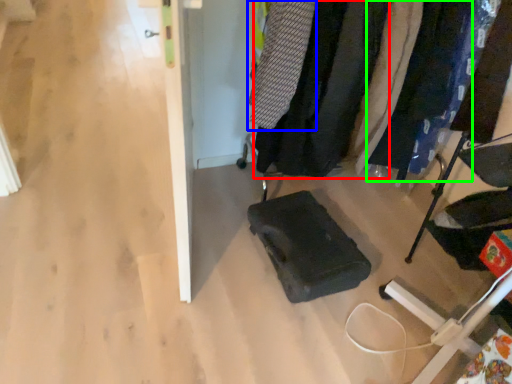
Question: Based on their relative distances, which object is farther from clothing (highlighted by a red box)? Choose from clothing (highlighted by a blue box) and clothing (highlighted by a green box).

Choices:
 (A) clothing
 (B) clothing

Answer: (B)